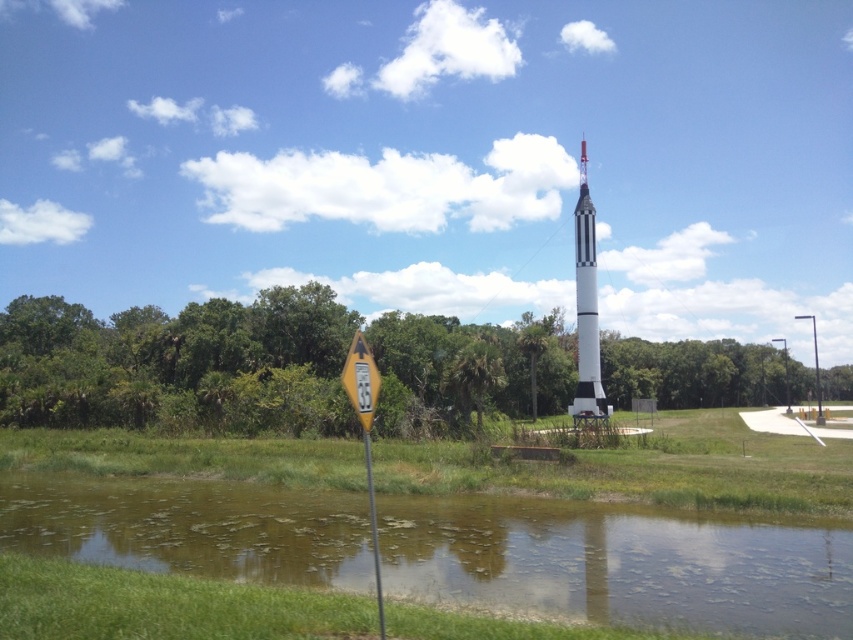
Locate an element on the screen. This screenshot has width=853, height=640. green grassy water at lower center is located at coordinates [x=618, y=564].

Is point (540, 572) positioned after point (367, 477)?

No, (540, 572) is closer to viewer.

At what (x,y) coordinates should I click in order to perform the action: click on green grassy water at lower center. Please return your answer as a coordinate pair (x, y). Image resolution: width=853 pixels, height=640 pixels. Looking at the image, I should click on (618, 564).

From the picture: Which is above, yellow reflective plastic at left or yellow reflective plastic road sign at lower center?

Positioned higher is yellow reflective plastic road sign at lower center.

Can you confirm if yellow reflective plastic at left is wider than yellow reflective plastic road sign at lower center?

Yes.

Locate an element on the screen. The height and width of the screenshot is (640, 853). yellow reflective plastic at left is located at coordinates (364, 435).

Based on the photo, measure the distance between point (x=581, y=412) and camera.

A distance of 197.09 feet exists between point (x=581, y=412) and camera.

Which is in front, point (582, 195) or point (350, 355)?

Point (350, 355)

Identify the location of white matte rocket at center. Image resolution: width=853 pixels, height=640 pixels. (585, 305).